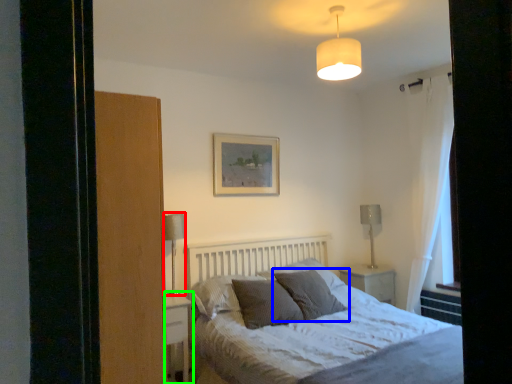
Question: Based on their relative distances, which object is farther from table lamp (highlighted by a red box)? Choose from pillow (highlighted by a blue box) and nightstand (highlighted by a green box).

Choices:
 (A) pillow
 (B) nightstand

Answer: (A)